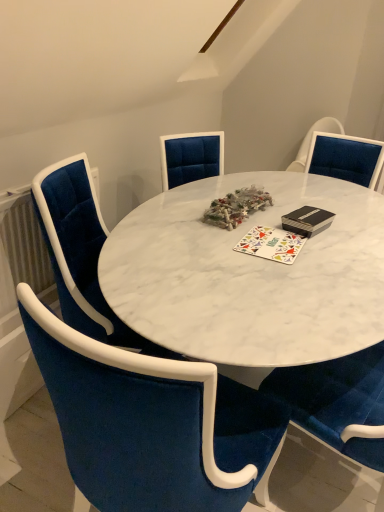
Image resolution: width=384 pixels, height=512 pixels. Find the location of `free space above multicolored fabric mat at center (from a real-world perspective)`. free space above multicolored fabric mat at center (from a real-world perspective) is located at coordinates (267, 237).